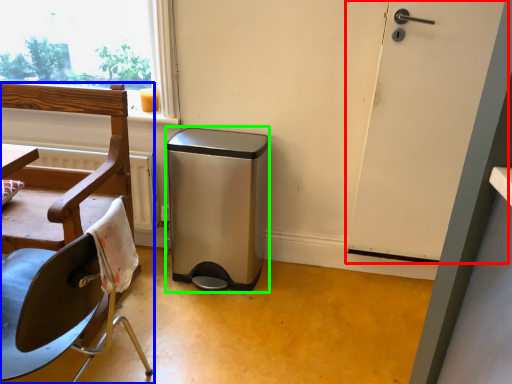
Question: Which is farther away from door (highlighted by a red box)? chair (highlighted by a blue box) or dish washer (highlighted by a green box)?

Choices:
 (A) chair
 (B) dish washer

Answer: (A)